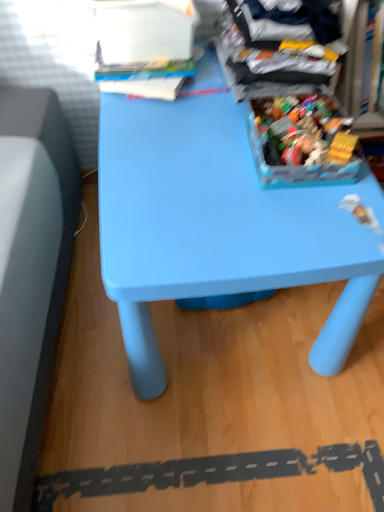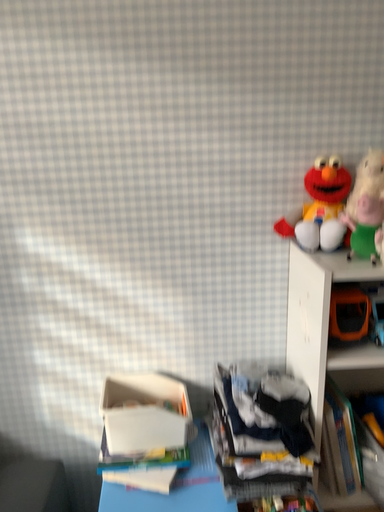
Question: Which way did the camera rotate in the video?

Choices:
 (A) rotated upward
 (B) rotated downward

Answer: (A)